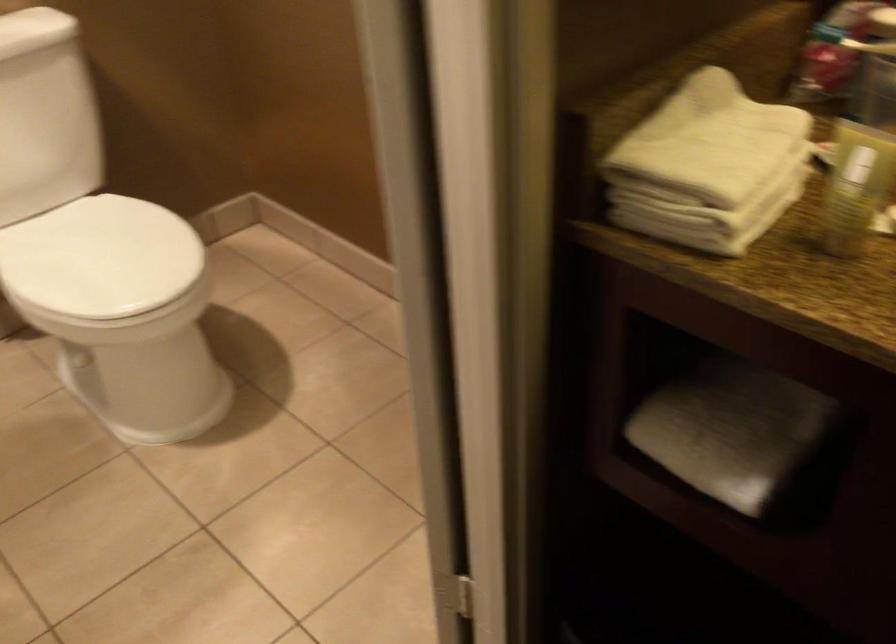
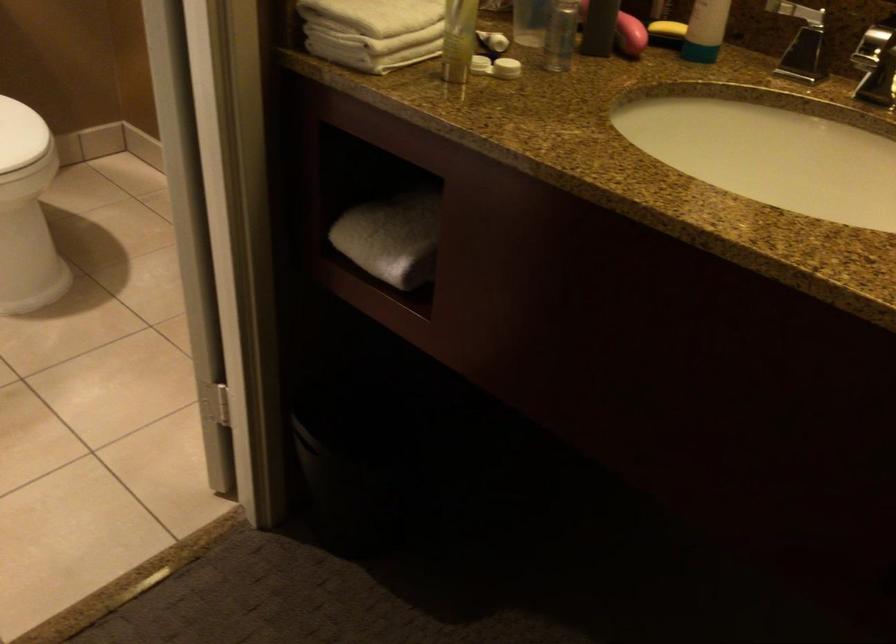
Where in the second image is the point corresponding to [720,228] from the first image?

(366, 51)